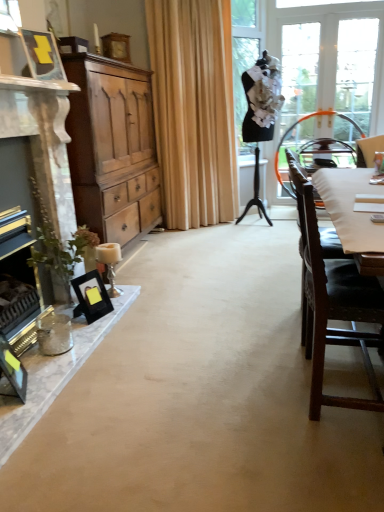
Question: From the image's perspective, is beige fabric curtain at center under black matte picture frame at lower left, marked as the 3th picture frame in a top-to-bottom arrangement?

Choices:
 (A) yes
 (B) no

Answer: (B)

Question: Does beige fabric curtain at center have a greater width compared to black matte picture frame at lower left, marked as the 2th picture frame in a bottom-to-top arrangement?

Choices:
 (A) no
 (B) yes

Answer: (B)

Question: Considering the relative positions of beige fabric curtain at center and black matte picture frame at lower left, marked as the second picture frame in a back-to-front arrangement, in the image provided, is beige fabric curtain at center to the right of black matte picture frame at lower left, marked as the second picture frame in a back-to-front arrangement, from the viewer's perspective?

Choices:
 (A) no
 (B) yes

Answer: (B)

Question: Is beige fabric curtain at center thinner than black matte picture frame at lower left, marked as the 2th picture frame in a bottom-to-top arrangement?

Choices:
 (A) no
 (B) yes

Answer: (A)

Question: Does beige fabric curtain at center come behind black matte picture frame at lower left, which appears as the third picture frame when viewed from the front?

Choices:
 (A) yes
 (B) no

Answer: (A)

Question: From the image's perspective, is beige fabric curtain at center on black matte picture frame at lower left, marked as the second picture frame in a back-to-front arrangement?

Choices:
 (A) no
 (B) yes

Answer: (B)

Question: From the image's perspective, is clear glass window at upper right below matte brown cabinet at left?

Choices:
 (A) no
 (B) yes

Answer: (A)

Question: Is clear glass window at upper right thinner than matte brown cabinet at left?

Choices:
 (A) no
 (B) yes

Answer: (B)

Question: Considering the relative sizes of clear glass window at upper right and matte brown cabinet at left in the image provided, is clear glass window at upper right smaller than matte brown cabinet at left?

Choices:
 (A) yes
 (B) no

Answer: (A)

Question: Is clear glass window at upper right positioned in front of matte brown cabinet at left?

Choices:
 (A) yes
 (B) no

Answer: (B)

Question: From a real-world perspective, is clear glass window at upper right over matte brown cabinet at left?

Choices:
 (A) yes
 (B) no

Answer: (A)

Question: Would you say clear glass window at upper right is outside matte brown cabinet at left?

Choices:
 (A) no
 (B) yes

Answer: (B)

Question: From the image's perspective, would you say beige fabric curtain at center is positioned over dark brown wood chair at right, which appears as the 1th chair when ordered from the bottom?

Choices:
 (A) no
 (B) yes

Answer: (B)